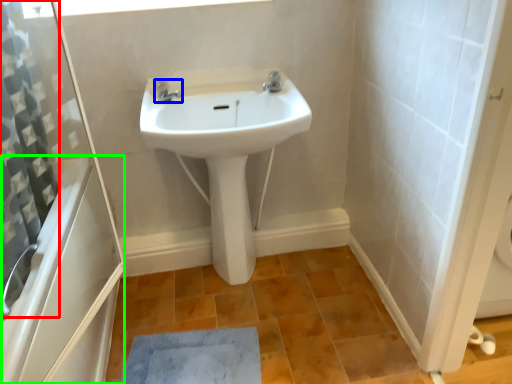
Question: Which object is the farthest from shower curtain (highlighted by a red box)? Choose among these: tap (highlighted by a blue box) or bath (highlighted by a green box).

Choices:
 (A) tap
 (B) bath

Answer: (A)